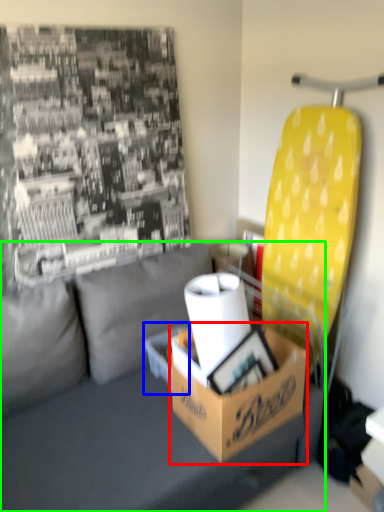
Question: Considering the real-world distances, which object is closest to box (highlighted by a red box)? cardboard box (highlighted by a blue box) or studio couch (highlighted by a green box).

Choices:
 (A) cardboard box
 (B) studio couch

Answer: (B)